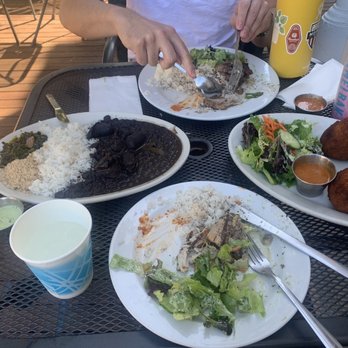
Find the location of a particular element. This screenshot has height=348, width=348. bottle yellow is located at coordinates (308, 21).